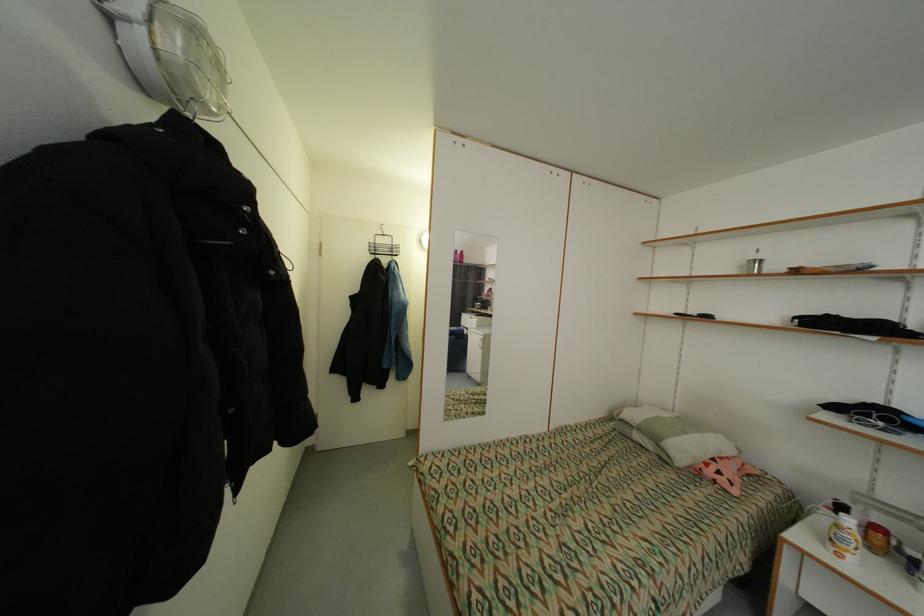
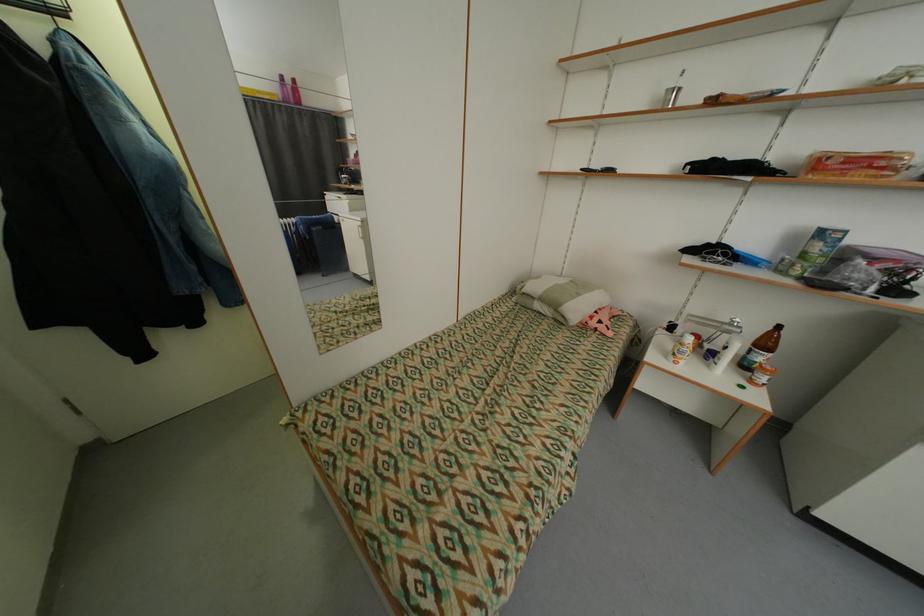
The images are taken continuously from a first-person perspective. In which direction is your viewpoint rotating?

The camera's rotation is toward right-down.